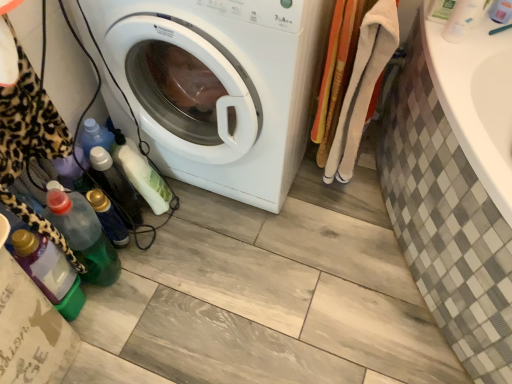
The image size is (512, 384). I want to click on free space in front of white glossy washing machine at center, so click(245, 287).